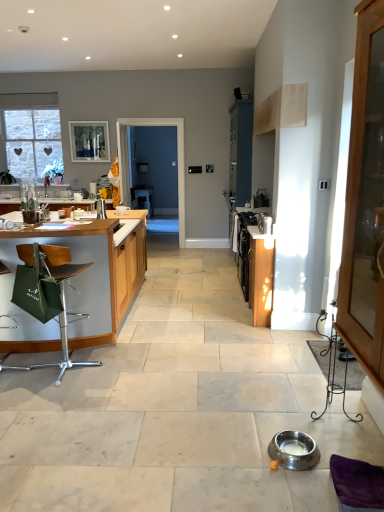
I want to click on vacant area that lies between purple fabric swivel chair at lower right and stainless steel bowl at lower center, acting as the 2th appliance starting from the top, so click(319, 472).